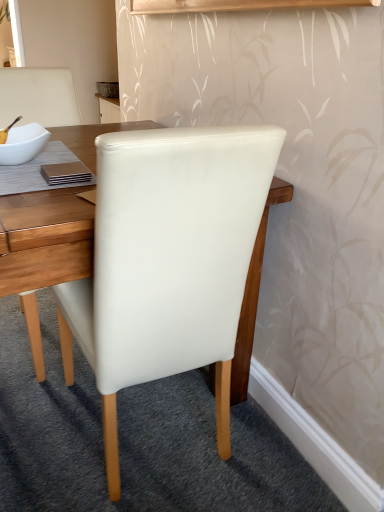
Question: From the image's perspective, is white leather chair at center located above or below white glossy bowl at upper left?

Choices:
 (A) below
 (B) above

Answer: (A)

Question: From a real-world perspective, relative to white glossy bowl at upper left, is white leather chair at center vertically above or below?

Choices:
 (A) below
 (B) above

Answer: (A)

Question: Would you say white leather chair at center is to the left or to the right of white glossy bowl at upper left in the picture?

Choices:
 (A) left
 (B) right

Answer: (B)

Question: Considering the positions of white glossy bowl at upper left and white leather chair at center in the image, is white glossy bowl at upper left bigger or smaller than white leather chair at center?

Choices:
 (A) big
 (B) small

Answer: (B)

Question: Relative to white leather chair at center, is white glossy bowl at upper left in front or behind?

Choices:
 (A) behind
 (B) front

Answer: (A)

Question: Considering the positions of point tap(26, 136) and point tap(107, 358), is point tap(26, 136) closer or farther from the camera than point tap(107, 358)?

Choices:
 (A) closer
 (B) farther

Answer: (B)

Question: Do you think white glossy bowl at upper left is within white leather chair at center, or outside of it?

Choices:
 (A) inside
 (B) outside

Answer: (B)